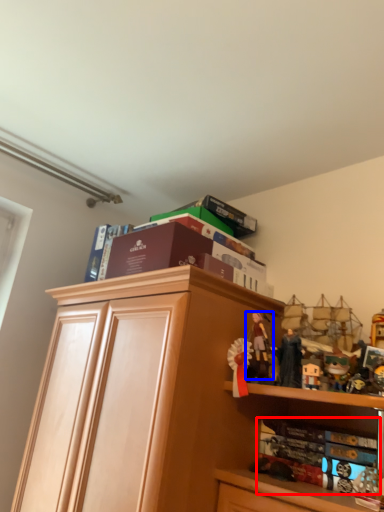
Question: Which point is closer to the camera, book (highlighted by a red box) or person (highlighted by a blue box)?

Choices:
 (A) book
 (B) person

Answer: (A)